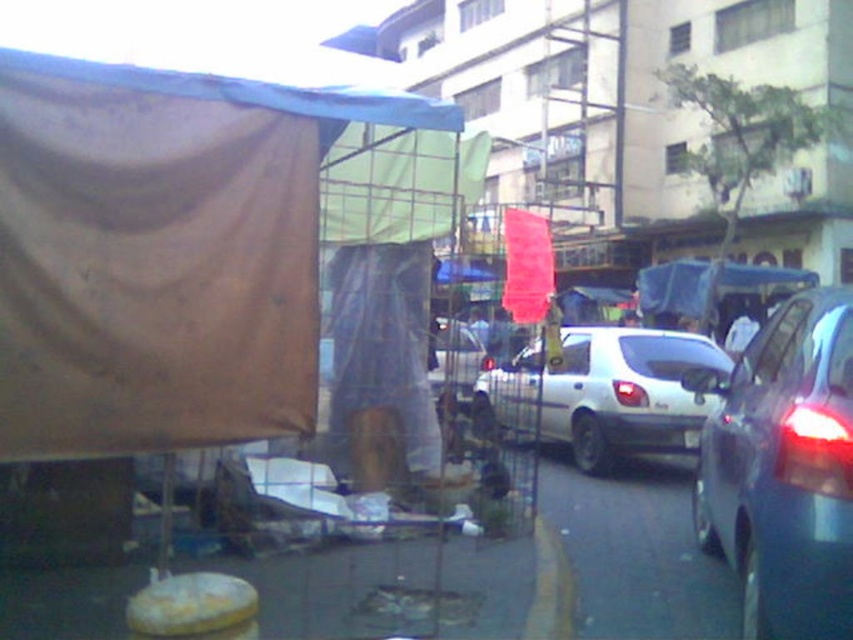
Question: Can you confirm if brown fabric canopy at upper left is positioned below metallic gray sedan at right?

Choices:
 (A) no
 (B) yes

Answer: (A)

Question: Which of the following is the closest to the observer?

Choices:
 (A) white plastic license plate at center
 (B) metallic silver car at center
 (C) brown fabric canopy at upper left

Answer: (C)

Question: Among these objects, which one is farthest from the camera?

Choices:
 (A) white matte hatchback at center
 (B) brown fabric canopy at upper left
 (C) white plastic license plate at center
 (D) metallic silver car at center

Answer: (C)

Question: Among these points, which one is nearest to the camera?

Choices:
 (A) (689, 444)
 (B) (822, 348)
 (C) (466, 356)

Answer: (B)

Question: In this image, where is white matte hatchback at center located relative to white plastic license plate at center?

Choices:
 (A) left
 (B) right

Answer: (A)

Question: Does metallic gray sedan at right come in front of metallic silver car at center?

Choices:
 (A) yes
 (B) no

Answer: (A)